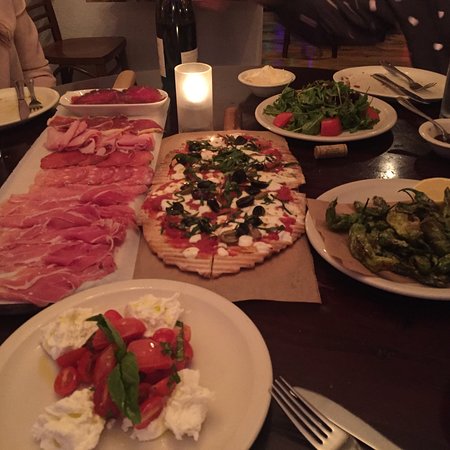
I want to click on cork, so click(326, 151).